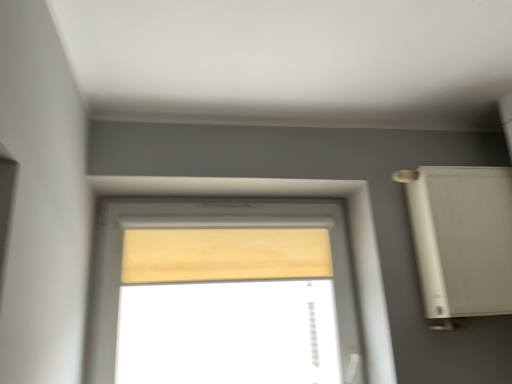
Question: Is beige fabric curtain at center aimed at white plastic air conditioner at right?

Choices:
 (A) yes
 (B) no

Answer: (B)

Question: Is white plastic air conditioner at right completely or partially inside beige fabric curtain at center?

Choices:
 (A) yes
 (B) no

Answer: (B)

Question: Are beige fabric curtain at center and white plastic air conditioner at right far apart?

Choices:
 (A) no
 (B) yes

Answer: (A)

Question: Does beige fabric curtain at center have a greater height compared to white plastic air conditioner at right?

Choices:
 (A) no
 (B) yes

Answer: (A)

Question: Is beige fabric curtain at center wider than white plastic air conditioner at right?

Choices:
 (A) no
 (B) yes

Answer: (A)

Question: Is beige fabric curtain at center oriented away from white plastic air conditioner at right?

Choices:
 (A) no
 (B) yes

Answer: (A)

Question: Is white plastic air conditioner at right in contact with wooden blind at center?

Choices:
 (A) yes
 (B) no

Answer: (B)

Question: Is white plastic air conditioner at right thinner than wooden blind at center?

Choices:
 (A) yes
 (B) no

Answer: (B)

Question: Is wooden blind at center surrounded by white plastic air conditioner at right?

Choices:
 (A) yes
 (B) no

Answer: (B)

Question: From the image's perspective, is white plastic air conditioner at right located beneath wooden blind at center?

Choices:
 (A) no
 (B) yes

Answer: (A)

Question: Is white plastic air conditioner at right not inside wooden blind at center?

Choices:
 (A) no
 (B) yes

Answer: (B)

Question: Can you confirm if white plastic air conditioner at right is smaller than wooden blind at center?

Choices:
 (A) no
 (B) yes

Answer: (A)

Question: Is white plastic air conditioner at right thinner than beige fabric curtain at center?

Choices:
 (A) yes
 (B) no

Answer: (B)